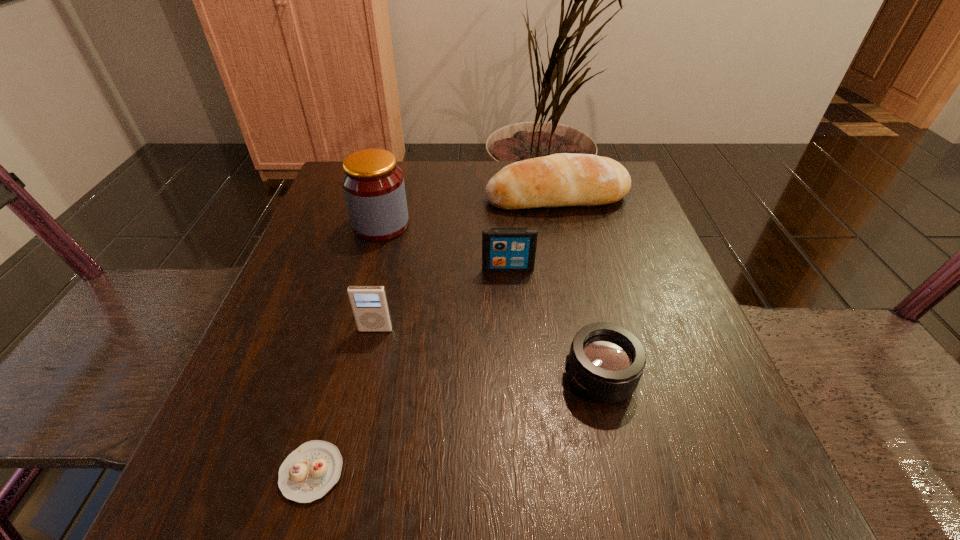
Identify the location of object that is at the near edge. (309, 472).

The image size is (960, 540). In order to click on jar positioned at the left edge in this screenshot , I will do `click(373, 184)`.

Identify the location of iPod present at the left edge. (369, 304).

Locate an element on the screen. The image size is (960, 540). cupcake that is at the left edge is located at coordinates (309, 472).

I want to click on bread at the right edge, so click(564, 179).

Locate an element on the screen. Image resolution: width=960 pixels, height=540 pixels. telephoto lens that is at the right edge is located at coordinates coord(606,361).

Find the location of `object located at the far left corner`. object located at the far left corner is located at coordinates (373, 184).

The width and height of the screenshot is (960, 540). What are the coordinates of `object at the near left corner` in the screenshot? It's located at (309, 472).

At what (x,y) coordinates should I click in order to perform the action: click on object that is at the far right corner. Please return your answer as a coordinate pair (x, y). This screenshot has height=540, width=960. Looking at the image, I should click on (564, 179).

At what (x,y) coordinates should I click in order to perform the action: click on vacant space at the far edge of the desktop. Please return your answer as a coordinate pair (x, y). The width and height of the screenshot is (960, 540). Looking at the image, I should click on (480, 161).